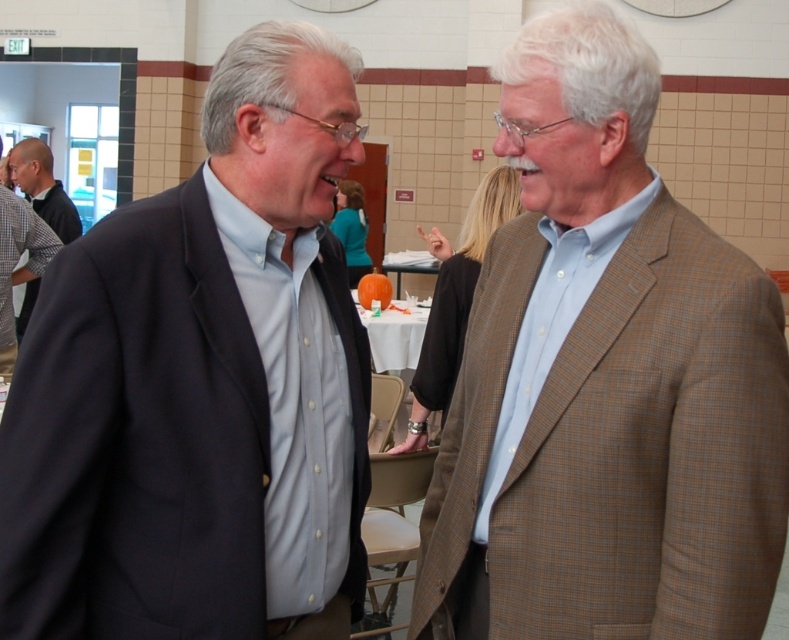
Does light brown checkered blazer at center have a smaller size compared to checkered shirt at left?

Yes, light brown checkered blazer at center is smaller than checkered shirt at left.

Is light brown checkered blazer at center below checkered shirt at left?

Correct, light brown checkered blazer at center is located below checkered shirt at left.

This screenshot has width=789, height=640. Find the location of `light brown checkered blazer at center`. light brown checkered blazer at center is located at coordinates (604, 381).

Is matte black suit at left positioned at the back of light brown checkered blazer at center?

No.

Does matte black suit at left have a greater height compared to light brown checkered blazer at center?

No.

I want to click on matte black suit at left, so click(200, 385).

Is matte black suit at left further to camera compared to checkered shirt at left?

No, it is in front of checkered shirt at left.

This screenshot has width=789, height=640. I want to click on matte black suit at left, so click(200, 385).

Where is `matte black suit at left`? This screenshot has height=640, width=789. matte black suit at left is located at coordinates (200, 385).